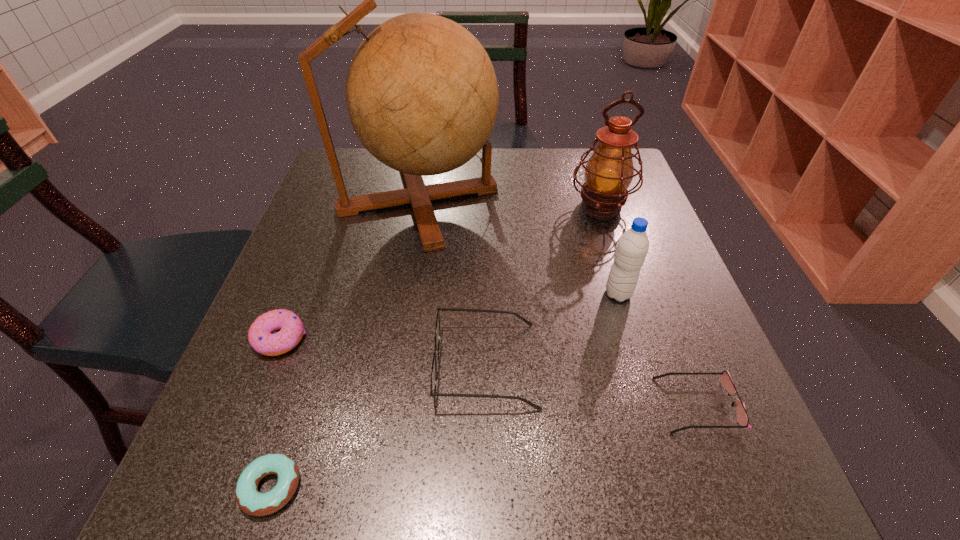
You are a GUI agent. You are given a task and a screenshot of the screen. Output one action in this format:
    pyautogui.click(x=<x>, y=<y>)
    Task: Click on the free point between the farther doughnut and the water bottle
    The image size is (960, 540).
    Given the screenshot: What is the action you would take?
    pyautogui.click(x=449, y=316)

Locate an element on the screen. free space between the farther doughnut and the spectacles is located at coordinates (383, 352).

Locate an element on the screen. The image size is (960, 540). the fourth closest object to the oil lamp is located at coordinates (742, 417).

Locate which object is the closest to the tallest object. Please provide its 2D coordinates. Your answer should be formatted as a tuple, i.e. [(x, y)], where the tuple contains the x and y coordinates of a point satisfying the conditions above.

[(609, 172)]

The image size is (960, 540). Find the location of `free location that satisfies the following two spatial constraints: 1. on the bridge of the sixth tallest object; 2. on the front side of the shortest object`. free location that satisfies the following two spatial constraints: 1. on the bridge of the sixth tallest object; 2. on the front side of the shortest object is located at coordinates (729, 487).

You are a GUI agent. You are given a task and a screenshot of the screen. Output one action in this format:
    pyautogui.click(x=<x>, y=<y>)
    Task: Click on the blank space that satisfies the following two spatial constraints: 1. on the surface of the globe; 2. on the right side of the water bottle
    Image resolution: width=960 pixels, height=540 pixels.
    Given the screenshot: What is the action you would take?
    pyautogui.click(x=403, y=294)

Identify the location of blank space that satisfies the following two spatial constraints: 1. on the back side of the second tallest object; 2. on the left side of the nearest object. Image resolution: width=960 pixels, height=540 pixels. (361, 206).